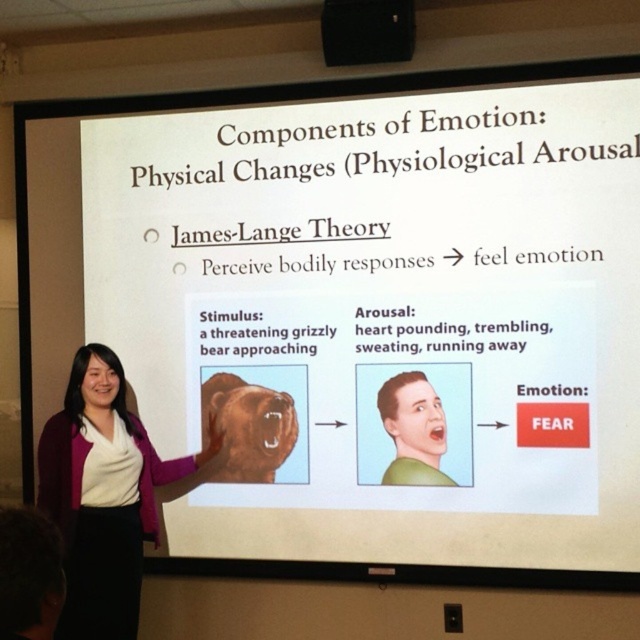
Can you confirm if matte purple sweater at center is positioned above black plastic projector at upper center?

No.

Is matte purple sweater at center below black plastic projector at upper center?

Indeed, matte purple sweater at center is positioned under black plastic projector at upper center.

Image resolution: width=640 pixels, height=640 pixels. Identify the location of matte purple sweater at center. (106, 496).

Is matte purple sweater at center shorter than green matte face at center?

Incorrect, matte purple sweater at center's height does not fall short of green matte face at center's.

Does matte purple sweater at center appear over green matte face at center?

No, matte purple sweater at center is not above green matte face at center.

Is point (106, 513) more distant than point (410, 404)?

That is False.

Where is `matte purple sweater at center`? The image size is (640, 640). matte purple sweater at center is located at coordinates (106, 496).

Between green matte face at center and black plastic projector at upper center, which one appears on the right side from the viewer's perspective?

green matte face at center is more to the right.

Between green matte face at center and black plastic projector at upper center, which one is positioned lower?

Positioned lower is green matte face at center.

Measure the distance between green matte face at center and camera.

green matte face at center and camera are 3.19 meters apart.

This screenshot has height=640, width=640. Identify the location of green matte face at center. (413, 429).